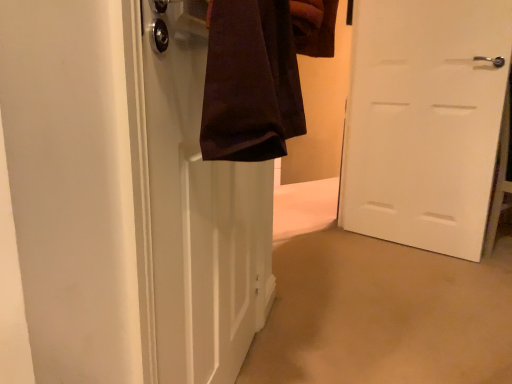
Locate an element on the screen. free region under white matte door at center (from a real-world perspective) is located at coordinates (413, 246).